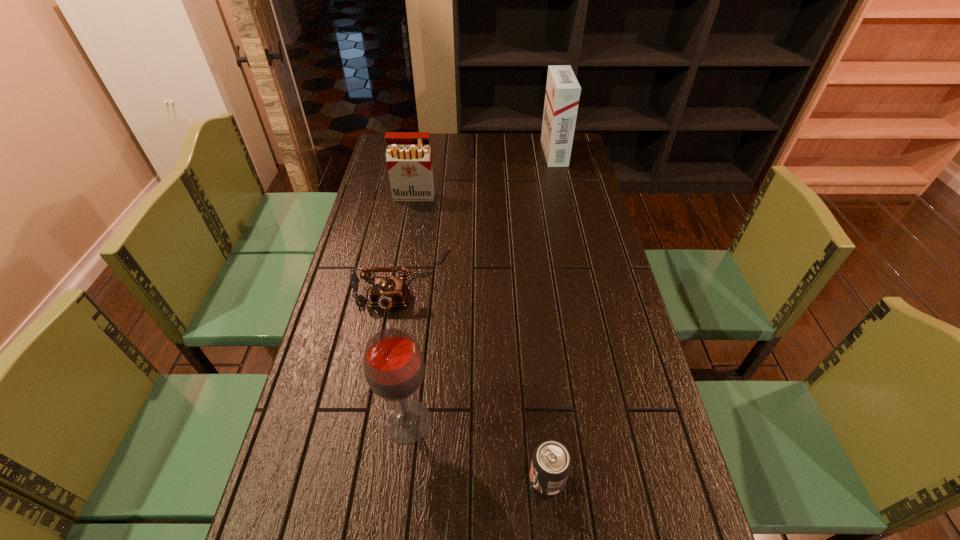
Where is `object that ranks as the third closest to the alcohol`? object that ranks as the third closest to the alcohol is located at coordinates (408, 155).

Point out which object is positioned as the fourth nearest to the third tallest object. Please provide its 2D coordinates. Your answer should be formatted as a tuple, i.e. [(x, y)], where the tuple contains the x and y coordinates of a point satisfying the conditions above.

[(551, 463)]

Locate an element on the screen. free spot that satisfies the following two spatial constraints: 1. on the dial of the telephone; 2. on the right side of the nearest object is located at coordinates click(370, 477).

At what (x,y) coordinates should I click in order to perform the action: click on vacant space that satisfies the following two spatial constraints: 1. with the lid open on the third tallest object; 2. on the left side of the alcohol. Please return your answer as a coordinate pair (x, y). This screenshot has height=540, width=960. Looking at the image, I should click on (374, 421).

You are a GUI agent. You are given a task and a screenshot of the screen. Output one action in this format:
    pyautogui.click(x=<x>, y=<y>)
    Task: Click on the blank space that satisfies the following two spatial constraints: 1. with the lid open on the alcohol; 2. on the left side of the left cigarette case
    
    Given the screenshot: What is the action you would take?
    tap(374, 421)

Locate an element on the screen. This screenshot has height=540, width=960. free location that satisfies the following two spatial constraints: 1. on the dial of the third nearest object; 2. on the right side of the second nearest object is located at coordinates (378, 421).

At what (x,y) coordinates should I click in order to perform the action: click on free space that satisfies the following two spatial constraints: 1. on the dial of the fourth tallest object; 2. on the right side of the nearest object. Please return your answer as a coordinate pair (x, y). The image size is (960, 540). Looking at the image, I should click on (370, 477).

At what (x,y) coordinates should I click in order to perform the action: click on free space that satisfies the following two spatial constraints: 1. on the dial of the second nearest object; 2. on the right side of the third farthest object. Please return your answer as a coordinate pair (x, y). The image size is (960, 540). Looking at the image, I should click on (378, 421).

Locate an element on the screen. free region that satisfies the following two spatial constraints: 1. on the dial of the telephone; 2. on the right side of the soda can is located at coordinates pyautogui.click(x=370, y=477).